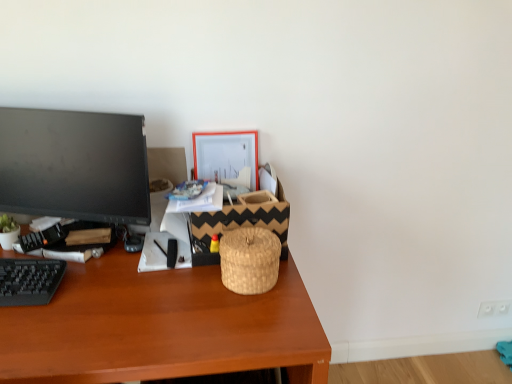
Identify the location of free space that is to the left of woven natural basket at center, the first basket in the front-to-back sequence. The height and width of the screenshot is (384, 512). (183, 293).